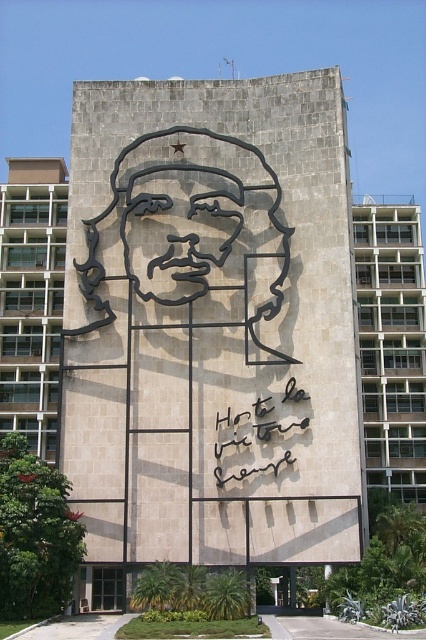
Does white matte text at center have a lesser width compared to black matte sculpture at center?

Yes.

Is white matte text at center taller than black matte sculpture at center?

In fact, white matte text at center may be shorter than black matte sculpture at center.

Measure the distance between white matte text at center and camera.

A: They are 53.46 meters apart.

The height and width of the screenshot is (640, 426). In order to click on white matte text at center in this screenshot , I will do `click(259, 435)`.